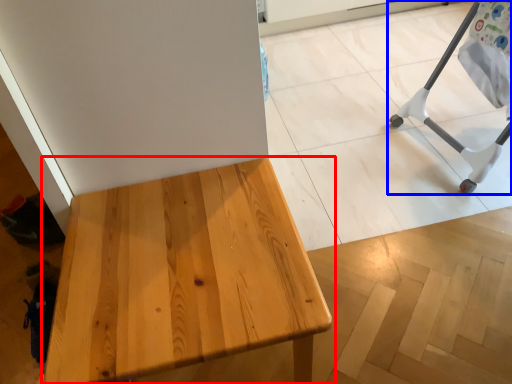
Question: Which point is closer to the camera, table (highlighted by a red box) or furniture (highlighted by a blue box)?

Choices:
 (A) table
 (B) furniture

Answer: (A)